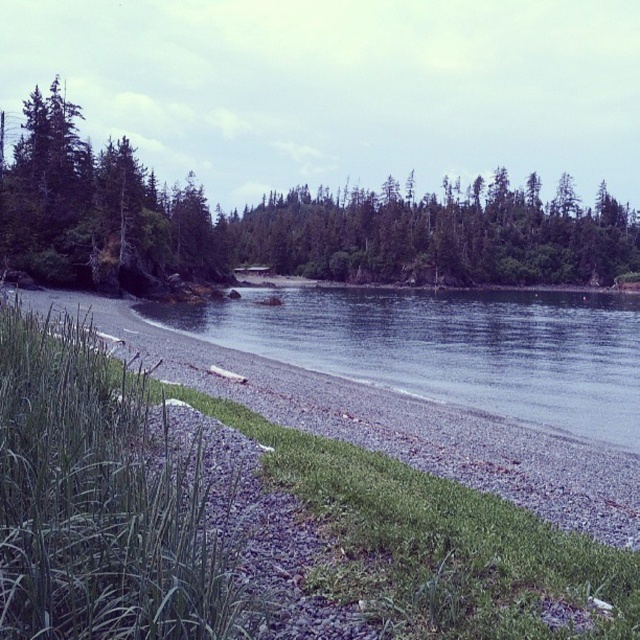
Question: Is green matte tree at upper left above green matte trees at center?

Choices:
 (A) yes
 (B) no

Answer: (B)

Question: Which point is closer to the camera?

Choices:
 (A) green matte tree at upper left
 (B) clear water at center

Answer: (B)

Question: Which of these objects is positioned closest to the green matte trees at center?

Choices:
 (A) green matte tree at upper left
 (B) clear water at center

Answer: (A)

Question: Is green matte tree at upper left thinner than green matte trees at center?

Choices:
 (A) yes
 (B) no

Answer: (B)

Question: Does clear water at center lie in front of green matte trees at center?

Choices:
 (A) yes
 (B) no

Answer: (A)

Question: Based on their relative distances, which object is nearer to the green matte trees at center?

Choices:
 (A) clear water at center
 (B) green matte tree at upper left

Answer: (B)